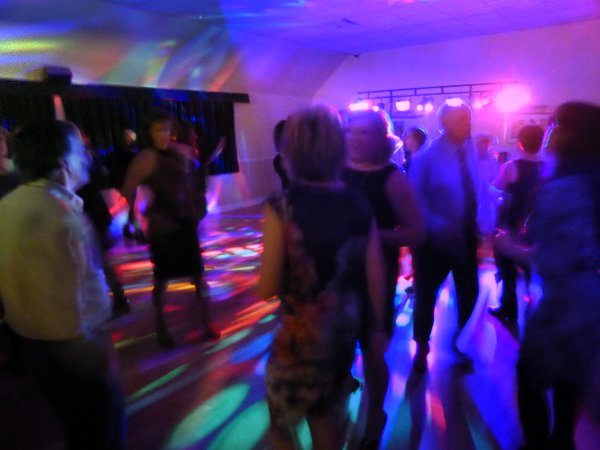
What are the coordinates of `curtains` in the screenshot? It's located at (201, 102).